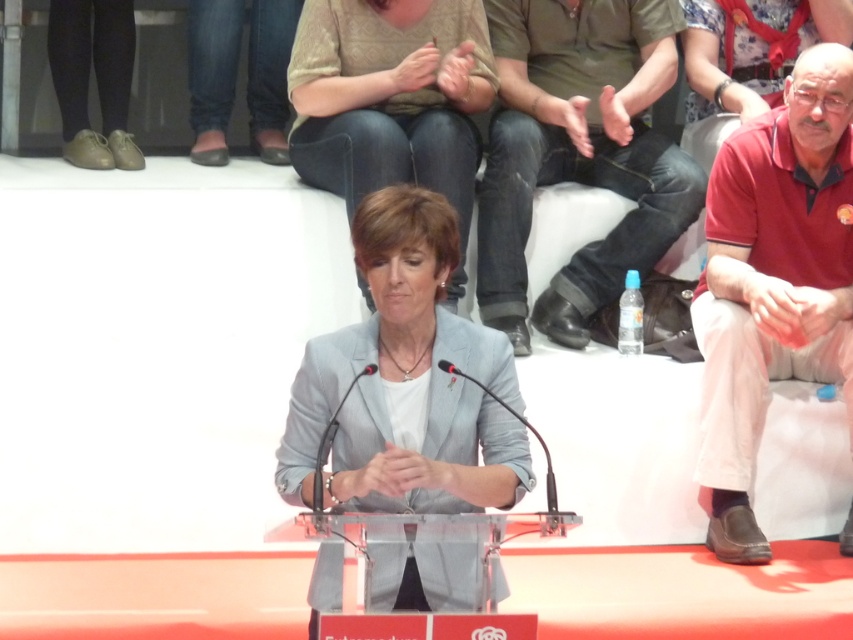
You are attending a formal event and notice the leather flat shoe at upper left and the matte gray blazer at center. Which item is located more to the left side of the scene?

The leather flat shoe at upper left is positioned on the left side of the matte gray blazer at center, so it is more to the left.

You are an event planner organizing a formal event. You need to ensure that the leather flat shoe at upper left and the matte gray blazer at center are visible to all attendees. Which object should be placed higher to ensure visibility?

The leather flat shoe at upper left should be placed higher because it is positioned under the matte gray blazer at center, which might block its view.

You are standing at the podium in the image. There are two points marked in the scene. The first point is at coordinates point (381, 248) and the second is at point (132, 29). Which point is closer to you?

Point (381, 248) is in front of point (132, 29), so it is closer to you.